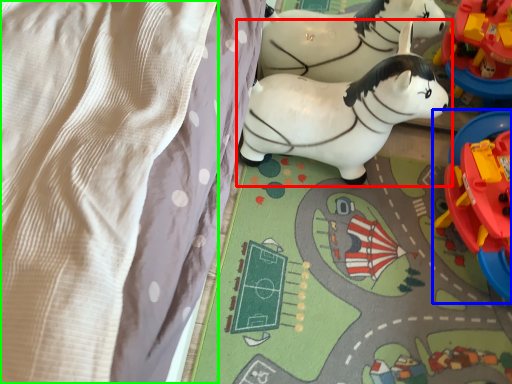
Question: Based on their relative distances, which object is nearer to toy (highlighted by a red box)? Choose from toy (highlighted by a blue box) and blanket (highlighted by a green box).

Choices:
 (A) toy
 (B) blanket

Answer: (A)